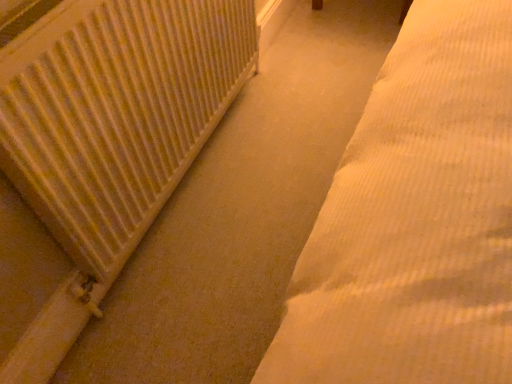
In order to face metallic gold radiator at left, should I rotate leftwards or rightwards?

You should look left and rotate roughly 11.004 degrees.

This screenshot has height=384, width=512. I want to click on metallic gold radiator at left, so click(116, 112).

This screenshot has height=384, width=512. What do you see at coordinates (116, 112) in the screenshot?
I see `metallic gold radiator at left` at bounding box center [116, 112].

Where is `metallic gold radiator at left`? metallic gold radiator at left is located at coordinates (116, 112).